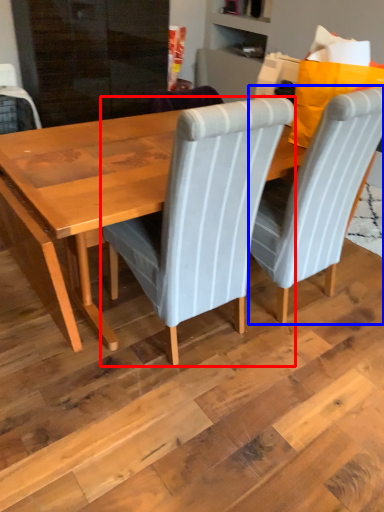
Question: Which object is further to the camera taking this photo, chair (highlighted by a red box) or chair (highlighted by a blue box)?

Choices:
 (A) chair
 (B) chair

Answer: (B)